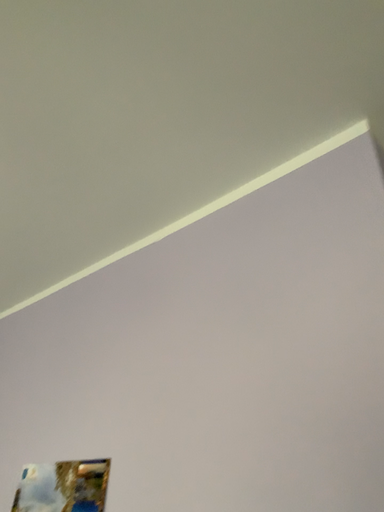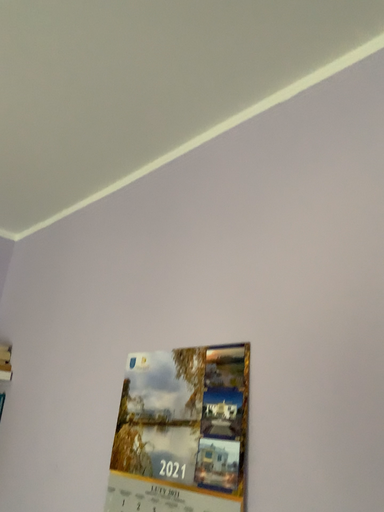
Question: Which way did the camera rotate in the video?

Choices:
 (A) rotated downward
 (B) rotated upward

Answer: (A)